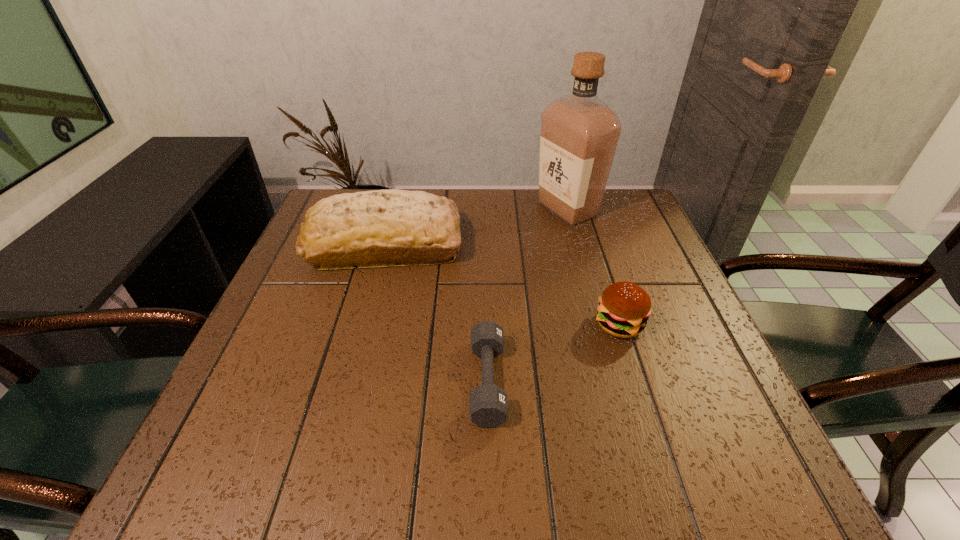
At what (x,y) coordinates should I click in order to perform the action: click on vacant space that satisfies the following two spatial constraints: 1. on the front-facing side of the liquor; 2. on the left side of the third tallest object. Please return your answer as a coordinate pair (x, y). Looking at the image, I should click on (599, 324).